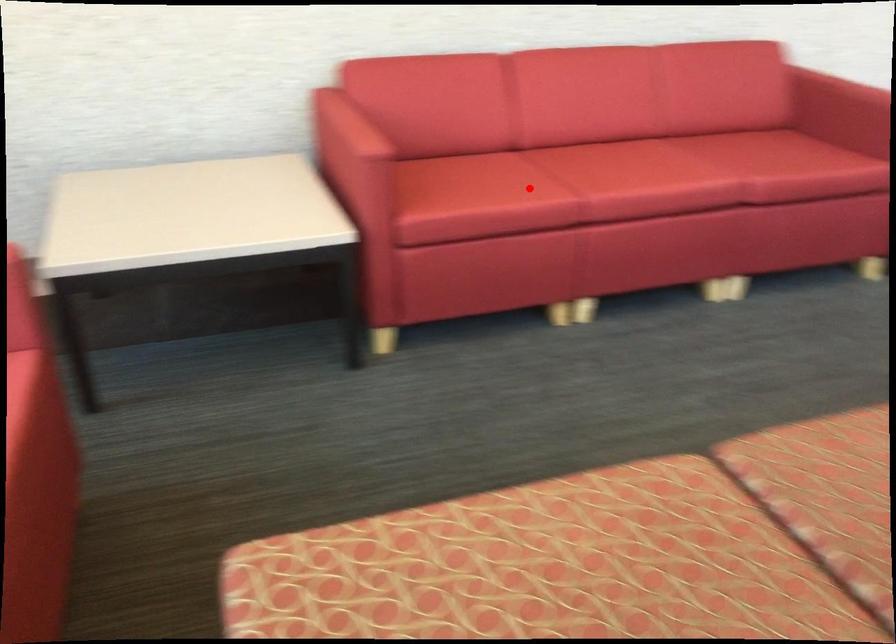
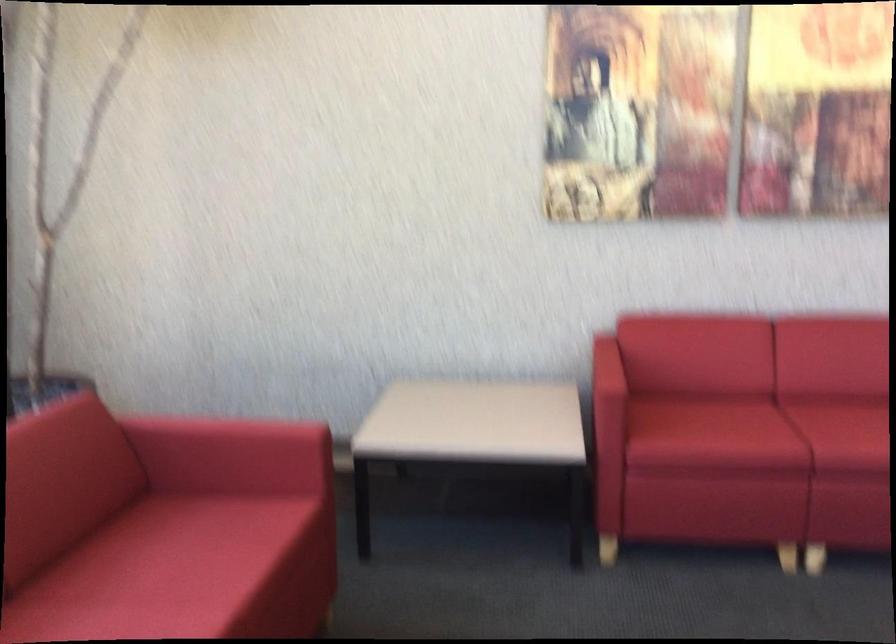
Locate, in the second image, the point that corresponds to the highlighted location in the first image.

(757, 431)